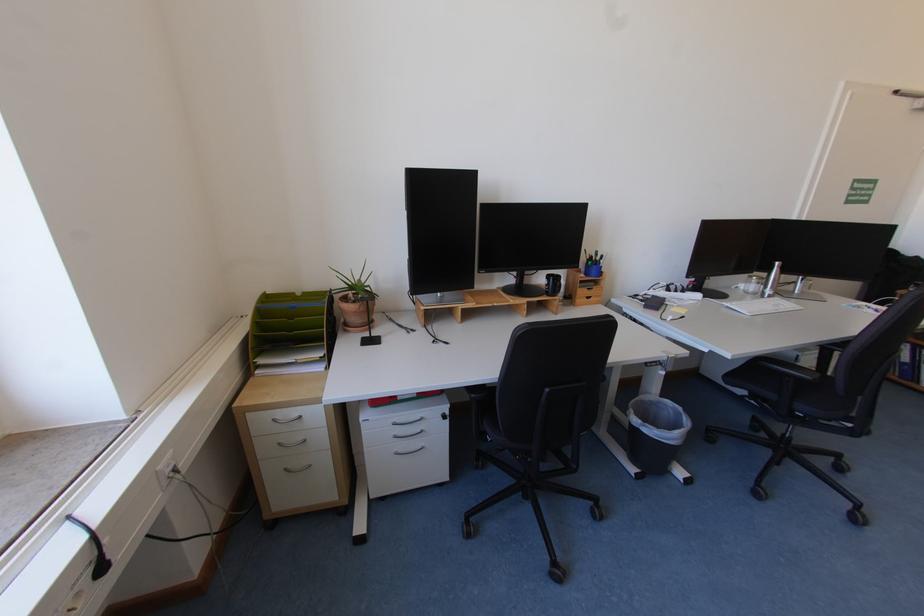
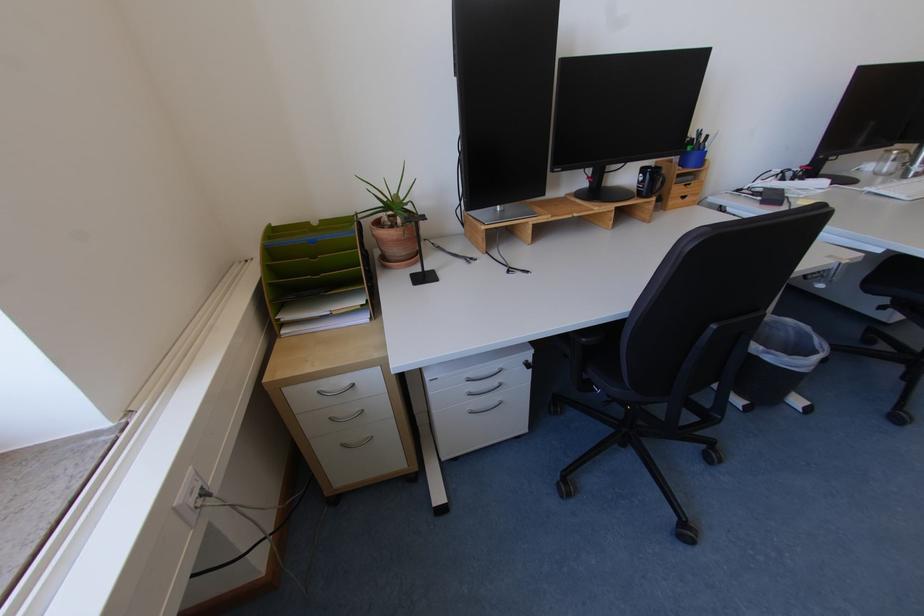
Question: The images are taken continuously from a first-person perspective. In which direction is your viewpoint rotating?

Choices:
 (A) Left
 (B) Right
 (C) Up
 (D) Down

Answer: (D)